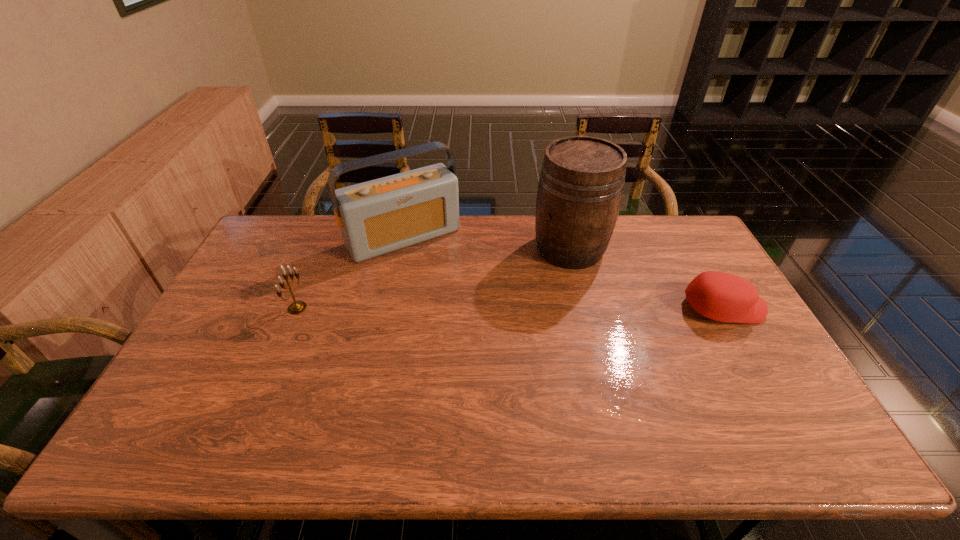
Locate an element on the screen. Image resolution: width=960 pixels, height=540 pixels. free spot on the desktop that is between the third tallest object and the shortest object and is positioned on the side of the second object from right to left near the bung hole is located at coordinates (465, 308).

Where is `vacant space on the desktop that is between the candelabrum and the rightmost object and is positioned on the front-facing side of the second object from left to right`? This screenshot has height=540, width=960. vacant space on the desktop that is between the candelabrum and the rightmost object and is positioned on the front-facing side of the second object from left to right is located at coordinates (453, 308).